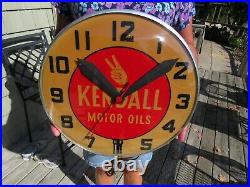
Find the location of a particular element. The image size is (250, 187). red circle in center of clock is located at coordinates (138, 68).